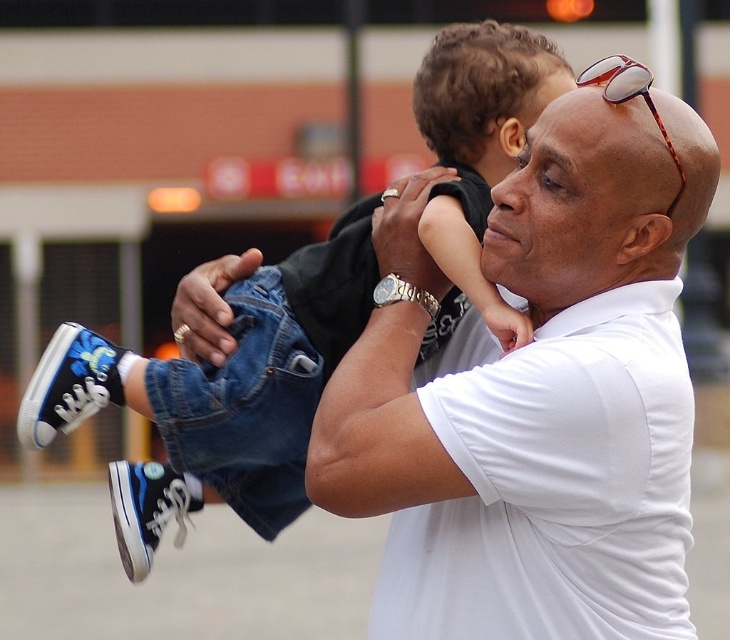
Question: Which object is closer to the camera taking this photo?

Choices:
 (A) white matte shirt at center
 (B) blue canvas sneakers at center

Answer: (A)

Question: Is white matte shirt at center to the left of blue canvas sneakers at center from the viewer's perspective?

Choices:
 (A) yes
 (B) no

Answer: (B)

Question: Can you confirm if white matte shirt at center is positioned to the right of blue canvas sneakers at center?

Choices:
 (A) yes
 (B) no

Answer: (A)

Question: Among these points, which one is nearest to the camera?

Choices:
 (A) (664, 305)
 (B) (537, 49)

Answer: (A)

Question: Which of the following is the closest to the observer?

Choices:
 (A) white matte shirt at center
 (B) blue canvas sneakers at center

Answer: (A)

Question: Can you confirm if white matte shirt at center is positioned to the right of blue canvas sneakers at center?

Choices:
 (A) yes
 (B) no

Answer: (A)